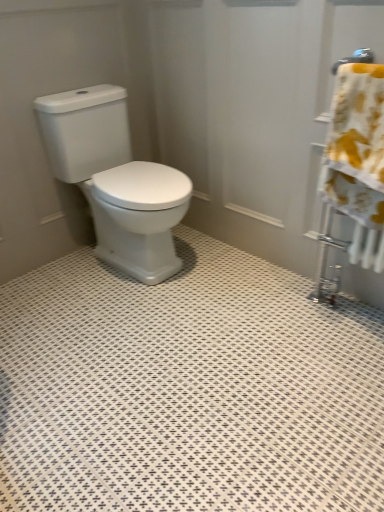
Image resolution: width=384 pixels, height=512 pixels. Describe the element at coordinates (115, 180) in the screenshot. I see `white glossy toilet at center` at that location.

Where is `white glossy toilet at center`? This screenshot has height=512, width=384. white glossy toilet at center is located at coordinates (115, 180).

Measure the distance between white glossy toilet at center and camera.

1.65 meters.

This screenshot has height=512, width=384. What are the coordinates of `yellow floral fabric at right` in the screenshot? It's located at (356, 145).

The image size is (384, 512). Describe the element at coordinates (356, 145) in the screenshot. I see `yellow floral fabric at right` at that location.

Where is `white glossy toilet at center`? This screenshot has width=384, height=512. white glossy toilet at center is located at coordinates (115, 180).

Looking at this image, which object is positioned more to the right, yellow floral fabric at right or white glossy toilet at center?

Positioned to the right is yellow floral fabric at right.

Is yellow floral fabric at right closer to camera compared to white glossy toilet at center?

Yes, the depth of yellow floral fabric at right is less than that of white glossy toilet at center.

Is point (364, 109) positioned in front of point (58, 142)?

Yes, point (364, 109) is in front of point (58, 142).

From the image's perspective, between yellow floral fabric at right and white glossy toilet at center, who is located below?

yellow floral fabric at right is shown below in the image.

From a real-world perspective, between yellow floral fabric at right and white glossy toilet at center, who is vertically higher?

yellow floral fabric at right, from a real-world perspective.

Is yellow floral fabric at right wider than white glossy toilet at center?

In fact, yellow floral fabric at right might be narrower than white glossy toilet at center.

Considering the sizes of objects yellow floral fabric at right and white glossy toilet at center in the image provided, who is shorter, yellow floral fabric at right or white glossy toilet at center?

With less height is yellow floral fabric at right.

Which of these two, yellow floral fabric at right or white glossy toilet at center, is bigger?

With larger size is white glossy toilet at center.

Is white glossy toilet at center a part of yellow floral fabric at right?

Definitely not — white glossy toilet at center is not inside yellow floral fabric at right.

Is yellow floral fabric at right in contact with white glossy toilet at center?

No, yellow floral fabric at right is not making contact with white glossy toilet at center.

Is yellow floral fabric at right turned away from white glossy toilet at center?

That's not correct — yellow floral fabric at right is not looking away from white glossy toilet at center.

This screenshot has height=512, width=384. I want to click on bath towel below the white glossy toilet at center (from the image's perspective), so click(356, 145).

Considering the positions of objects white glossy toilet at center and yellow floral fabric at right in the image provided, who is more to the right, white glossy toilet at center or yellow floral fabric at right?

yellow floral fabric at right.

Is white glossy toilet at center in front of yellow floral fabric at right?

No, the depth of white glossy toilet at center is greater than that of yellow floral fabric at right.

Looking at this image, which point is more forward, (87, 131) or (369, 213)?

Positioned in front is point (369, 213).

From the image's perspective, which object appears higher, white glossy toilet at center or yellow floral fabric at right?

white glossy toilet at center appears higher in the image.

From a real-world perspective, is white glossy toilet at center physically above yellow floral fabric at right?

Incorrect, from a real-world perspective, white glossy toilet at center is lower than yellow floral fabric at right.

Considering the relative sizes of white glossy toilet at center and yellow floral fabric at right in the image provided, is white glossy toilet at center wider than yellow floral fabric at right?

Correct, the width of white glossy toilet at center exceeds that of yellow floral fabric at right.

Is white glossy toilet at center taller than yellow floral fabric at right?

Yes, white glossy toilet at center is taller than yellow floral fabric at right.

Between white glossy toilet at center and yellow floral fabric at right, which one has larger size?

Bigger between the two is white glossy toilet at center.

Consider the image. Is white glossy toilet at center located outside yellow floral fabric at right?

white glossy toilet at center lies outside yellow floral fabric at right's area.

Is the surface of white glossy toilet at center in direct contact with yellow floral fabric at right?

No.

Is white glossy toilet at center turned away from yellow floral fabric at right?

No, white glossy toilet at center's orientation is not away from yellow floral fabric at right.

Where is `toilet above the yellow floral fabric at right (from the image's perspective)`? The height and width of the screenshot is (512, 384). toilet above the yellow floral fabric at right (from the image's perspective) is located at coordinates (115, 180).

The image size is (384, 512). I want to click on toilet on the left side of yellow floral fabric at right, so click(115, 180).

Locate an element on the screen. The image size is (384, 512). toilet behind the yellow floral fabric at right is located at coordinates (115, 180).